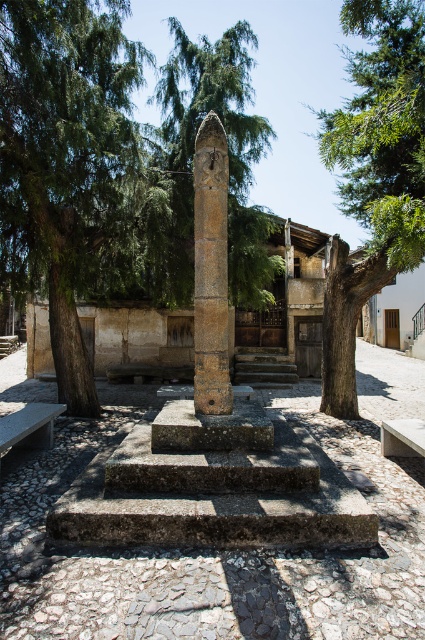
In order to click on green leafy tree at left in this screenshot , I will do pos(68,164).

Is green leafy tree at left to the left of green leafy tree at right from the viewer's perspective?

Indeed, green leafy tree at left is positioned on the left side of green leafy tree at right.

Is point (135, 193) more distant than point (342, 112)?

No, (135, 193) is closer to viewer.

Find the location of `green leafy tree at left`. green leafy tree at left is located at coordinates (68, 164).

This screenshot has width=425, height=640. I want to click on green leafy tree at right, so click(x=374, y=177).

Can you confirm if green leafy tree at right is shorter than brown stone column at center?

No, green leafy tree at right is not shorter than brown stone column at center.

Measure the distance between green leafy tree at right and camera.

green leafy tree at right is 5.02 meters away from camera.

I want to click on green leafy tree at right, so click(x=374, y=177).

Is point (28, 163) less distant than point (214, 285)?

No, (28, 163) is behind (214, 285).

Which of these two, green leafy tree at left or brown stone column at center, stands shorter?

Standing shorter between the two is brown stone column at center.

Is point (122, 140) farther from viewer compared to point (210, 212)?

Yes, it is behind point (210, 212).

Identify the location of green leafy tree at left. This screenshot has width=425, height=640. (68, 164).